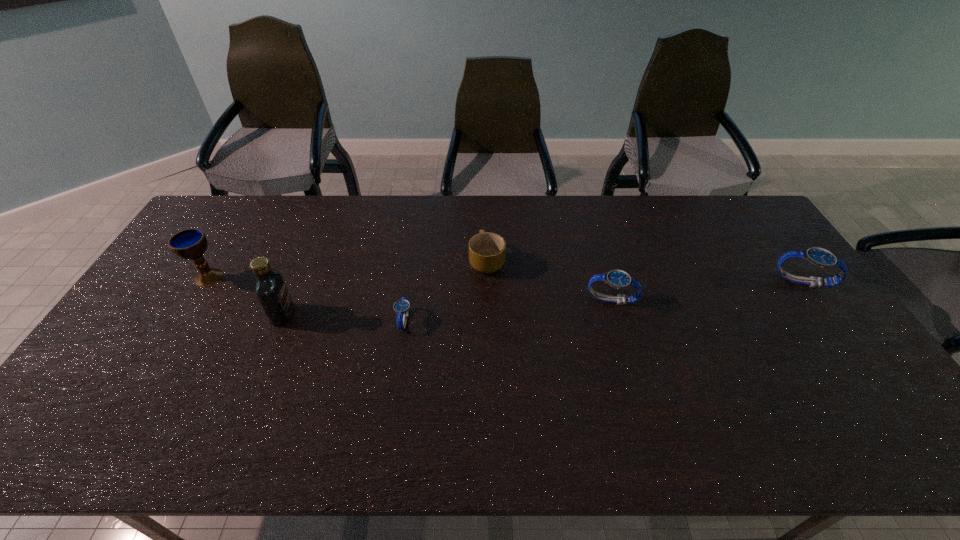
The watchs are evenly distributed in the image. To maintain this, where would you place another watch on the left? Please point to a free space. Please provide its 2D coordinates. Your answer should be formatted as a tuple, i.e. [(x, y)], where the tuple contains the x and y coordinates of a point satisfying the conditions above.

[(179, 342)]